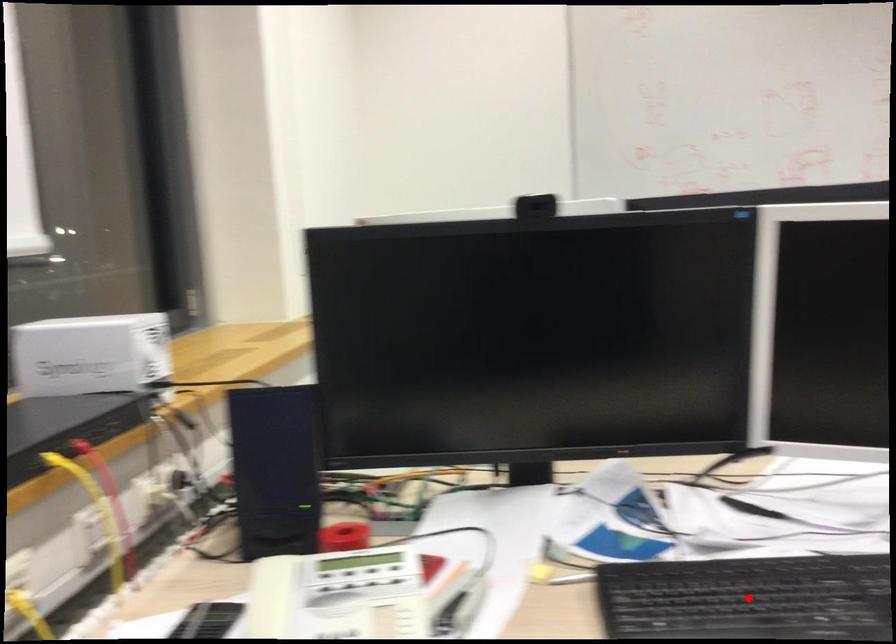
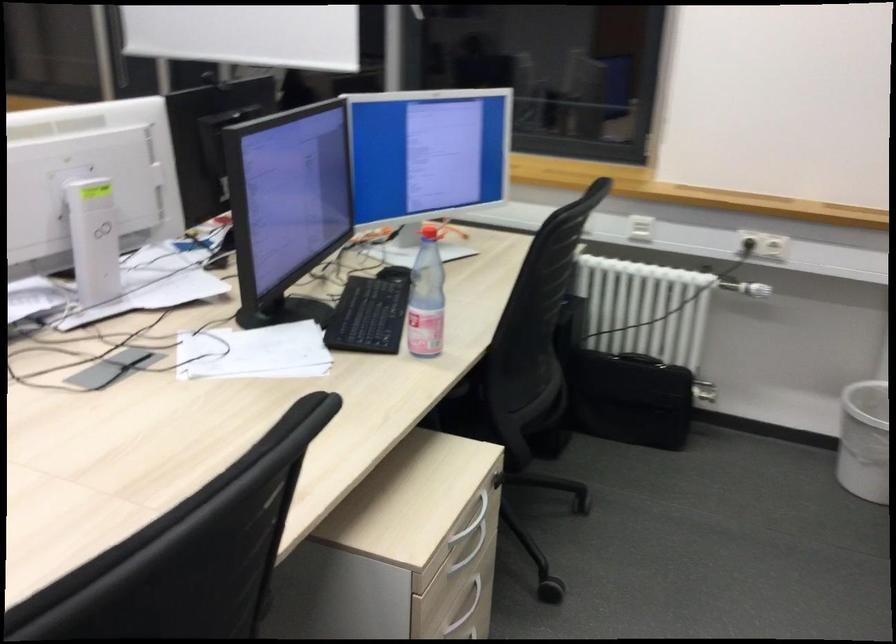
Question: I am providing you with two images of the same scene from different viewpoints. A red point is marked on the first image. At the location where the point appears in image 1, is it still visible in image 2?

Choices:
 (A) Yes
 (B) No

Answer: (B)